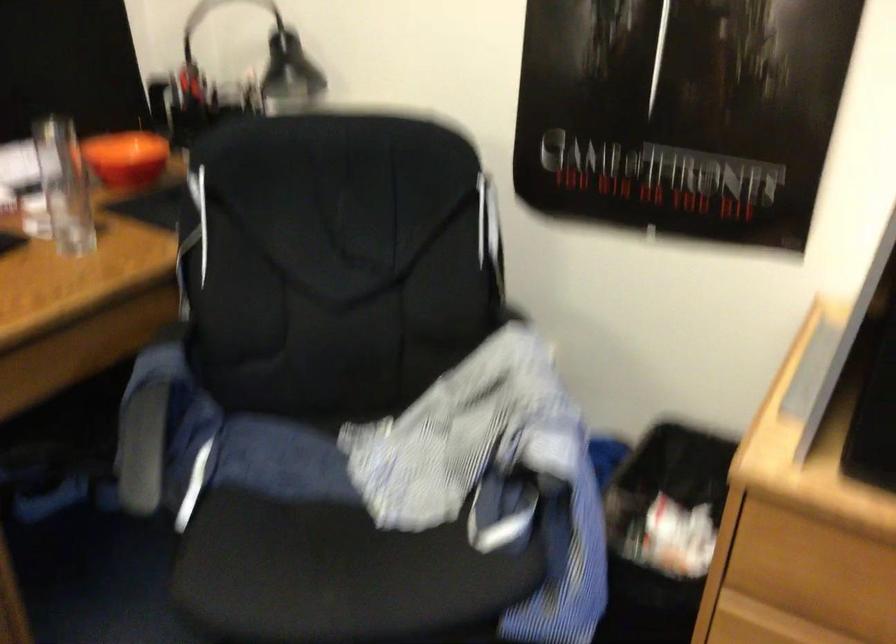
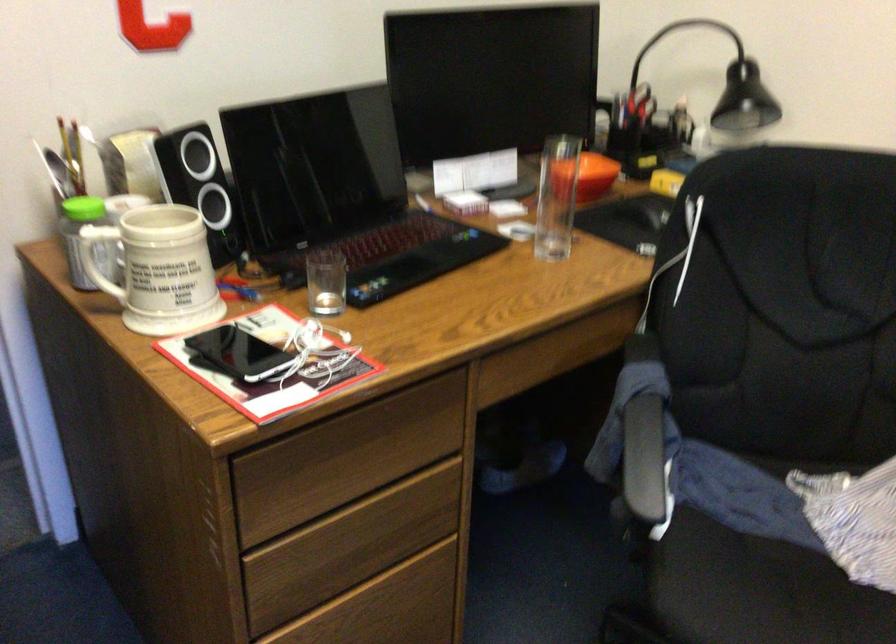
Where in the second image is the point corresponding to (288,553) from the first image?

(757, 591)